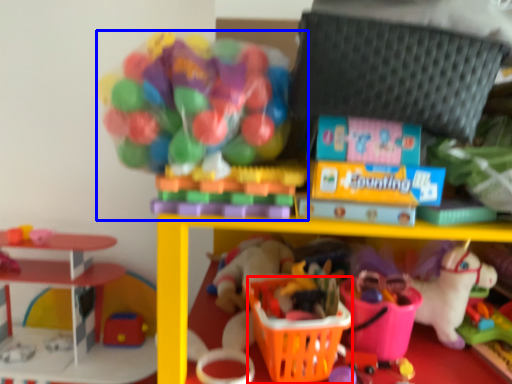
Question: Which object is further to the camera taking this photo, basket (highlighted by a red box) or toy (highlighted by a blue box)?

Choices:
 (A) basket
 (B) toy

Answer: (A)